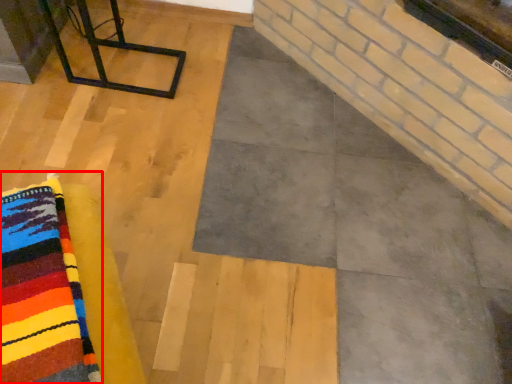
Question: From the image's perspective, where is cloth (annotated by the red box) located relative to furniture?

Choices:
 (A) below
 (B) above

Answer: (A)